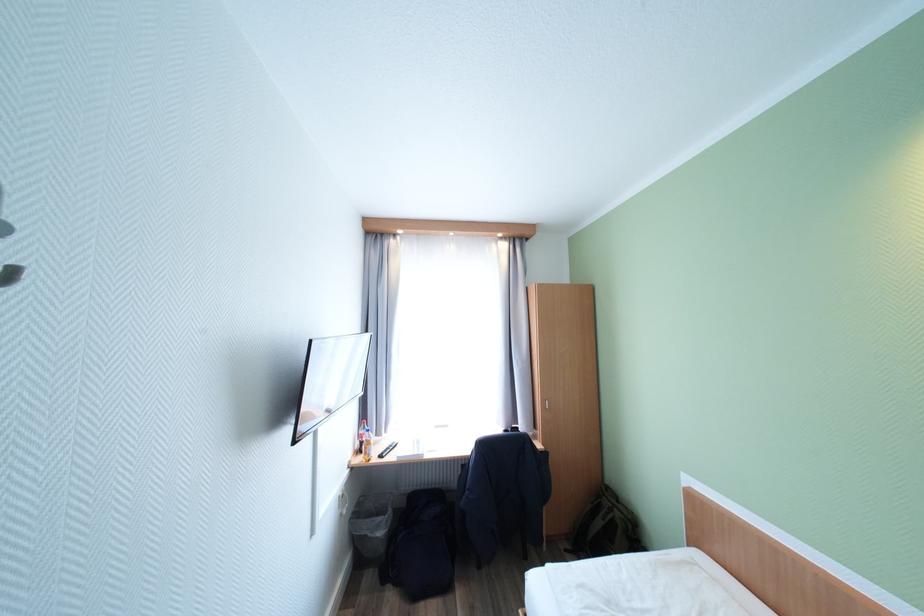
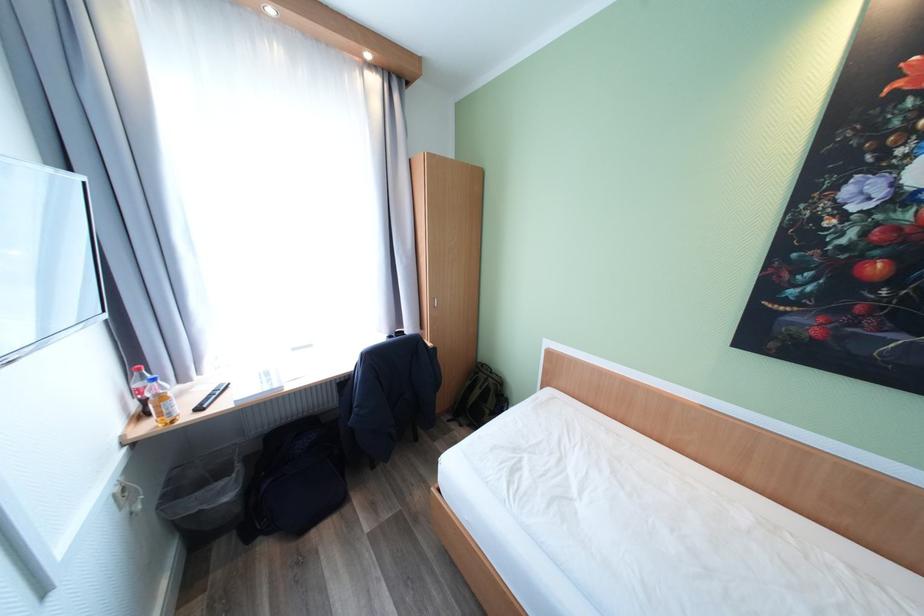
How did the camera likely rotate?

The camera's rotation is toward right-down.